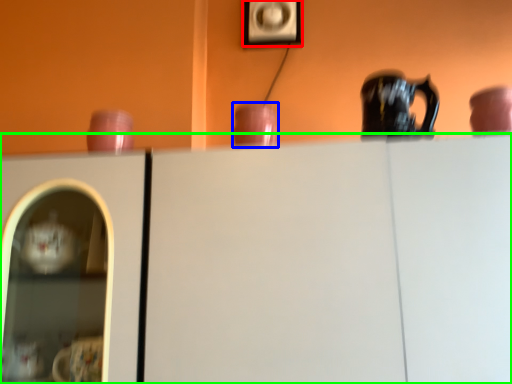
Question: Based on their relative distances, which object is nearer to picture frame (highlighted by a red box)? Choose from tableware (highlighted by a blue box) and cabinetry (highlighted by a green box).

Choices:
 (A) tableware
 (B) cabinetry

Answer: (A)